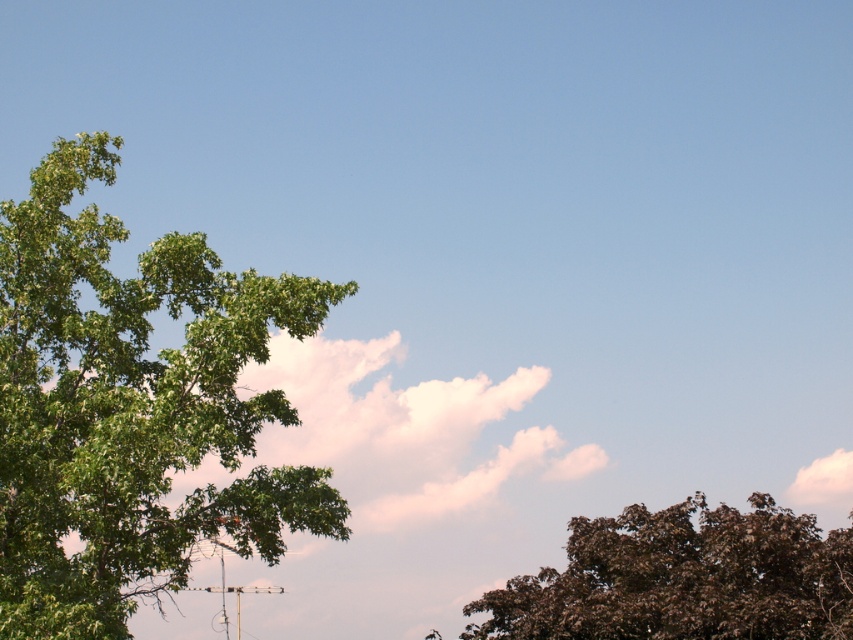
Is the position of green leafy tree at left more distant than that of brown textured tree at lower right?

No, it is in front of brown textured tree at lower right.

Is green leafy tree at left bigger than brown textured tree at lower right?

Incorrect, green leafy tree at left is not larger than brown textured tree at lower right.

Between point (341, 524) and point (547, 592), which one is positioned in front?

Positioned in front is point (341, 524).

I want to click on green leafy tree at left, so (131, 408).